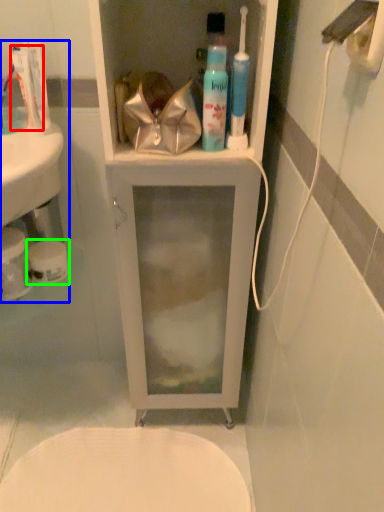
Question: Estimate the real-world distances between objects in this image. Which object is closer to toothpaste (highlighted by a red box), sink (highlighted by a blue box) or toilet paper (highlighted by a green box)?

Choices:
 (A) sink
 (B) toilet paper

Answer: (A)